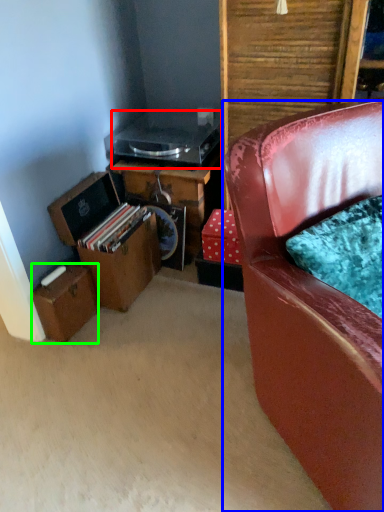
Question: Which object is positioned closest to appliance (highlighted by a red box)? Select from chair (highlighted by a blue box) and box (highlighted by a green box).

Choices:
 (A) chair
 (B) box

Answer: (B)